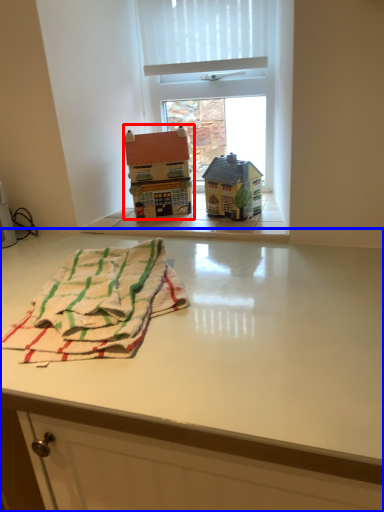
Question: Which point is closer to the camera, toy (highlighted by a red box) or table (highlighted by a blue box)?

Choices:
 (A) toy
 (B) table

Answer: (B)